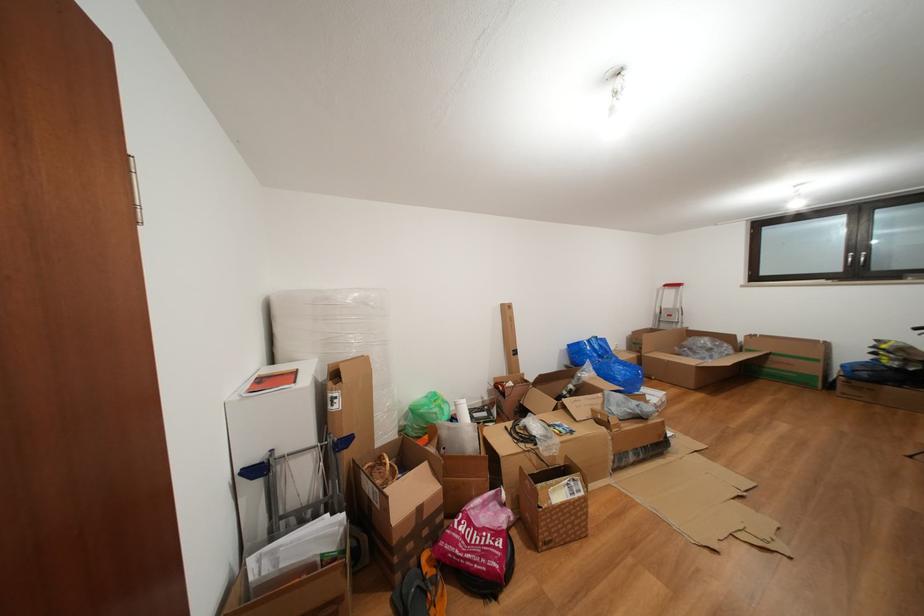
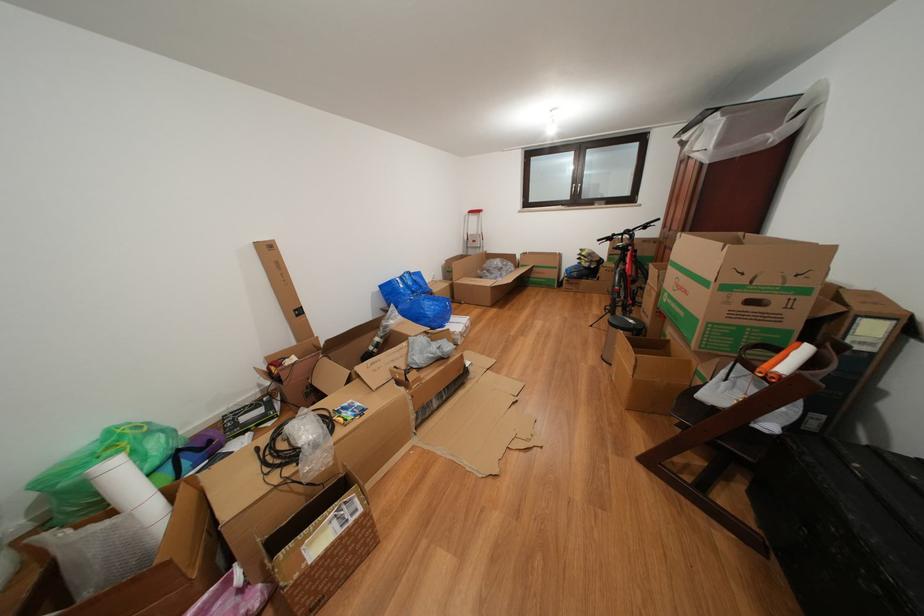
Locate, in the second image, the point that corresponds to the point at 743,341 in the first image.

(523, 261)